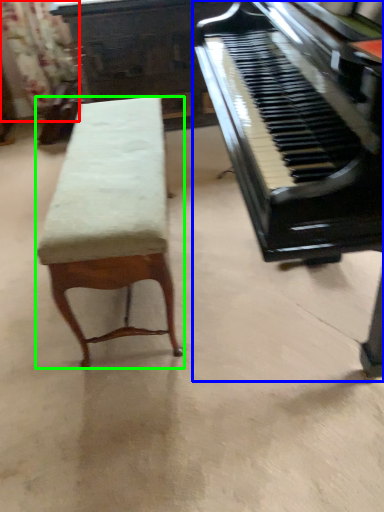
Question: Which is nearer to the curtain (highlighted by a red box)? piano (highlighted by a blue box) or furniture (highlighted by a green box).

Choices:
 (A) piano
 (B) furniture

Answer: (B)